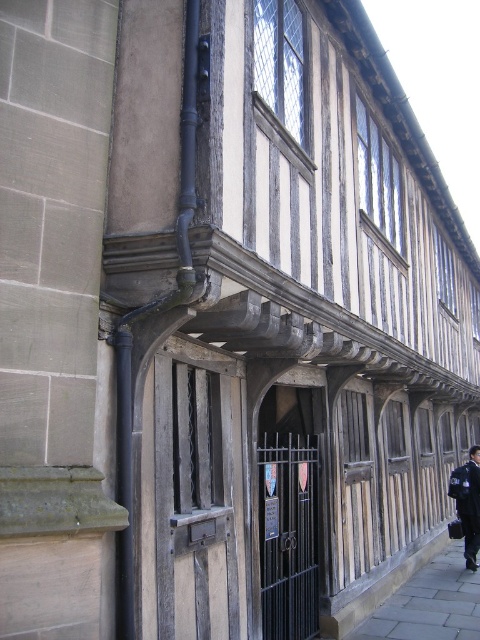
Can you confirm if paved stone sidewalk at lower right is wider than dark blue uniform at center?

Correct, the width of paved stone sidewalk at lower right exceeds that of dark blue uniform at center.

Which of these two, paved stone sidewalk at lower right or dark blue uniform at center, stands taller?

dark blue uniform at center

Between point (472, 593) and point (471, 540), which one is positioned in front?

Point (472, 593)

This screenshot has height=640, width=480. I want to click on paved stone sidewalk at lower right, so click(430, 604).